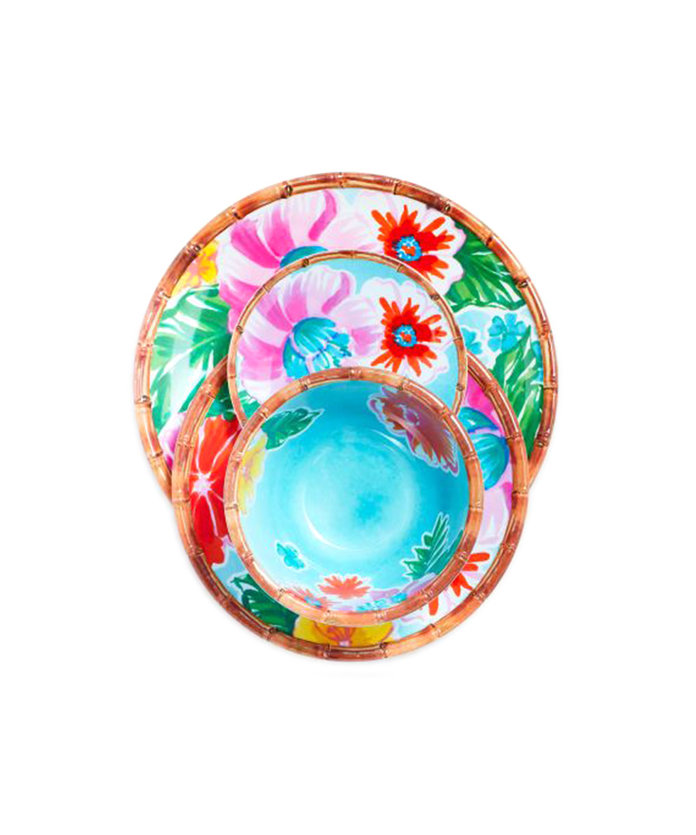
I want to click on plate, so click(367, 515), click(321, 319), click(505, 306), click(506, 451).